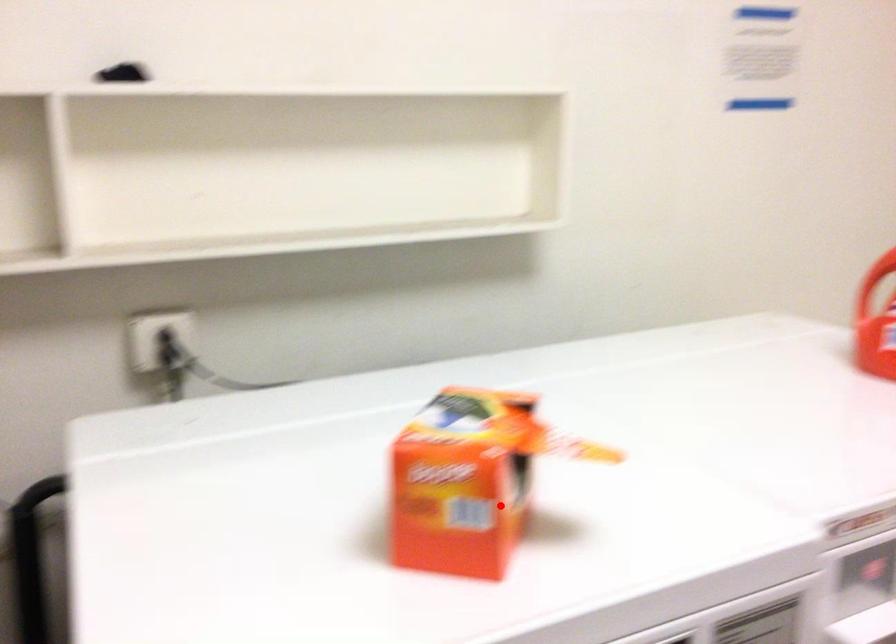
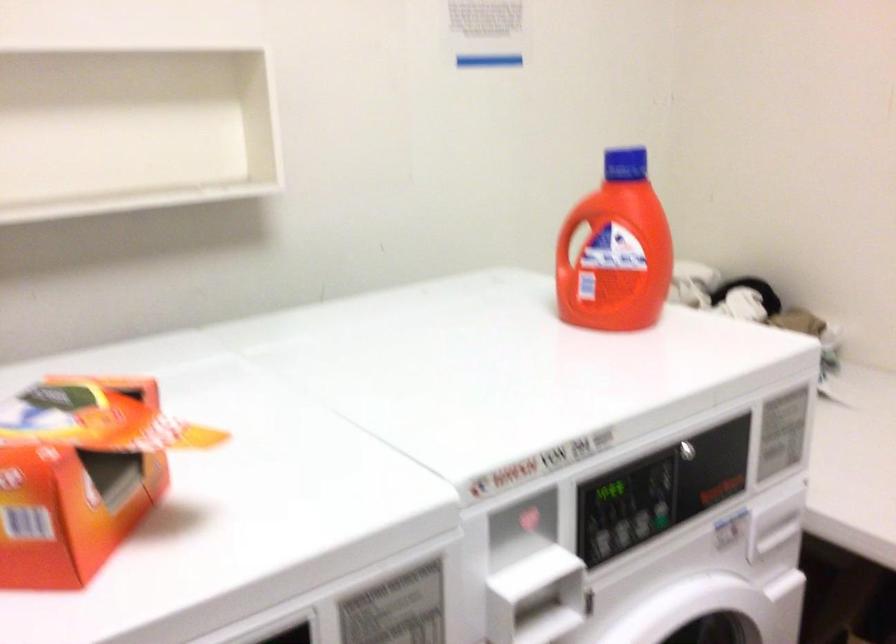
Question: A red point is marked in image1. In image2, is the corresponding 3D point closer to the camera or farther? Reply with the corresponding letter.

Choices:
 (A) The corresponding 3D point is closer.
 (B) The corresponding 3D point is farther.

Answer: (A)